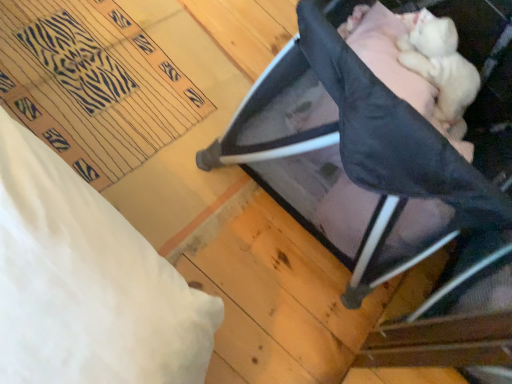
Locate an element on the screen. The height and width of the screenshot is (384, 512). white fluffy newborn at upper right is located at coordinates (440, 67).

This screenshot has width=512, height=384. What do you see at coordinates (440, 67) in the screenshot? I see `white fluffy newborn at upper right` at bounding box center [440, 67].

The image size is (512, 384). What do you see at coordinates (325, 178) in the screenshot? I see `black mesh playpen at upper right` at bounding box center [325, 178].

Find the location of `black mesh playpen at upper right`. black mesh playpen at upper right is located at coordinates (325, 178).

The image size is (512, 384). I want to click on white fluffy newborn at upper right, so click(x=440, y=67).

Considering the relative positions of black mesh playpen at upper right and white fluffy newborn at upper right in the image provided, is black mesh playpen at upper right to the right of white fluffy newborn at upper right from the viewer's perspective?

Incorrect, black mesh playpen at upper right is not on the right side of white fluffy newborn at upper right.

Is black mesh playpen at upper right further to the viewer compared to white fluffy newborn at upper right?

No.

Between point (285, 74) and point (450, 93), which one is positioned in front?

The point (285, 74) is closer to the camera.

In the scene shown: From the image's perspective, is black mesh playpen at upper right located beneath white fluffy newborn at upper right?

Yes, from the image's perspective, black mesh playpen at upper right is beneath white fluffy newborn at upper right.

From a real-world perspective, is black mesh playpen at upper right above or below white fluffy newborn at upper right?

black mesh playpen at upper right is above white fluffy newborn at upper right.

Between black mesh playpen at upper right and white fluffy newborn at upper right, which one has larger width?

black mesh playpen at upper right.

Who is taller, black mesh playpen at upper right or white fluffy newborn at upper right?

With more height is black mesh playpen at upper right.

Does black mesh playpen at upper right have a smaller size compared to white fluffy newborn at upper right?

No, black mesh playpen at upper right is not smaller than white fluffy newborn at upper right.

Choose the correct answer: Is black mesh playpen at upper right inside white fluffy newborn at upper right or outside it?

black mesh playpen at upper right is not enclosed by white fluffy newborn at upper right.

From the picture: Is black mesh playpen at upper right placed right next to white fluffy newborn at upper right?

No, black mesh playpen at upper right is not touching white fluffy newborn at upper right.

Is black mesh playpen at upper right oriented towards white fluffy newborn at upper right?

No, black mesh playpen at upper right does not turn towards white fluffy newborn at upper right.

What's the angular difference between black mesh playpen at upper right and white fluffy newborn at upper right's facing directions?

90 degrees.

Image resolution: width=512 pixels, height=384 pixels. What are the coordinates of `newborn located behind the black mesh playpen at upper right` in the screenshot? It's located at (440, 67).

Which object is positioned more to the left, white fluffy newborn at upper right or black mesh playpen at upper right?

black mesh playpen at upper right is more to the left.

Between white fluffy newborn at upper right and black mesh playpen at upper right, which one is positioned behind?

Positioned behind is white fluffy newborn at upper right.

Which is closer, [460,131] or [358,275]?

The point [358,275] is more forward.

From the image's perspective, does white fluffy newborn at upper right appear lower than black mesh playpen at upper right?

Incorrect, from the image's perspective, white fluffy newborn at upper right is higher than black mesh playpen at upper right.

From a real-world perspective, which is physically above, white fluffy newborn at upper right or black mesh playpen at upper right?

black mesh playpen at upper right is physically above.

Which object is wider, white fluffy newborn at upper right or black mesh playpen at upper right?

black mesh playpen at upper right.

Does white fluffy newborn at upper right have a lesser height compared to black mesh playpen at upper right?

Yes, white fluffy newborn at upper right is shorter than black mesh playpen at upper right.

In terms of size, does white fluffy newborn at upper right appear bigger or smaller than black mesh playpen at upper right?

Considering their sizes, white fluffy newborn at upper right takes up less space than black mesh playpen at upper right.

Is black mesh playpen at upper right completely or partially inside white fluffy newborn at upper right?

No, black mesh playpen at upper right is not inside white fluffy newborn at upper right.

Is the surface of white fluffy newborn at upper right in direct contact with black mesh playpen at upper right?

white fluffy newborn at upper right and black mesh playpen at upper right are not in contact.

Is white fluffy newborn at upper right oriented towards black mesh playpen at upper right?

Yes, white fluffy newborn at upper right faces towards black mesh playpen at upper right.

Where is `furniture on the left of white fluffy newborn at upper right`? The width and height of the screenshot is (512, 384). furniture on the left of white fluffy newborn at upper right is located at coordinates (325, 178).

This screenshot has height=384, width=512. In order to click on newborn on the right of black mesh playpen at upper right in this screenshot , I will do `click(440, 67)`.

Locate an element on the screen. The image size is (512, 384). furniture in front of the white fluffy newborn at upper right is located at coordinates (325, 178).